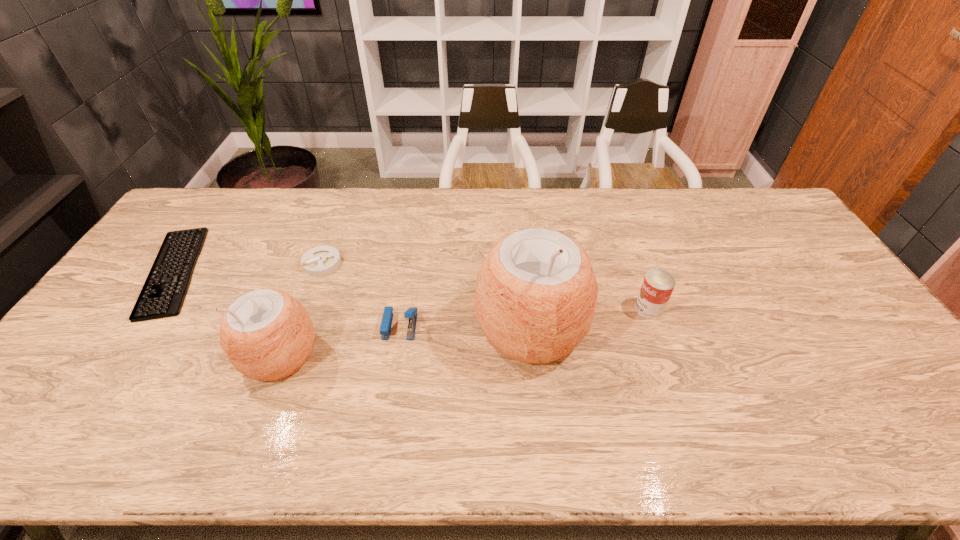
Locate an element on the screen. The height and width of the screenshot is (540, 960). vacant space in between the fifth object from left to right and the stapler is located at coordinates 466,327.

I want to click on object that can be found as the second closest to the right coconut, so click(x=386, y=323).

Locate an element on the screen. object that is the second nearest to the rightmost object is located at coordinates (386, 323).